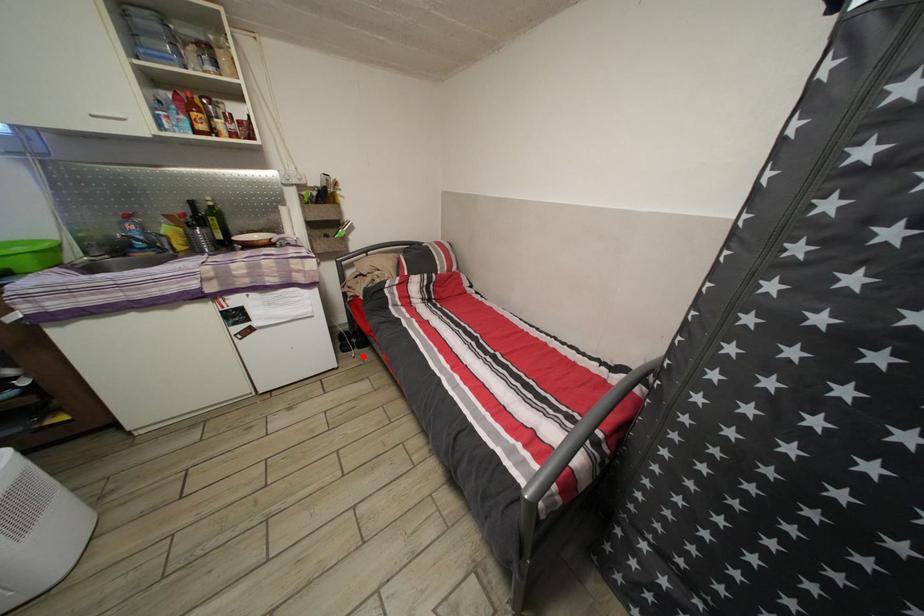
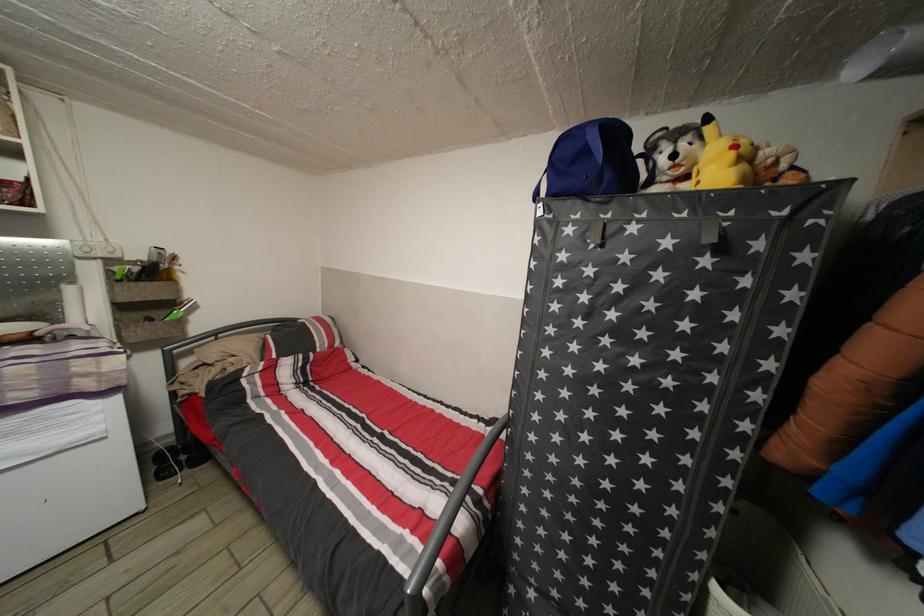
Question: I am providing you with two images of the same scene from different viewpoints. A red point is shown in image1. For the corresponding object point in image2, is it positioned nearer or farther from the camera?

Choices:
 (A) Nearer
 (B) Farther

Answer: (A)